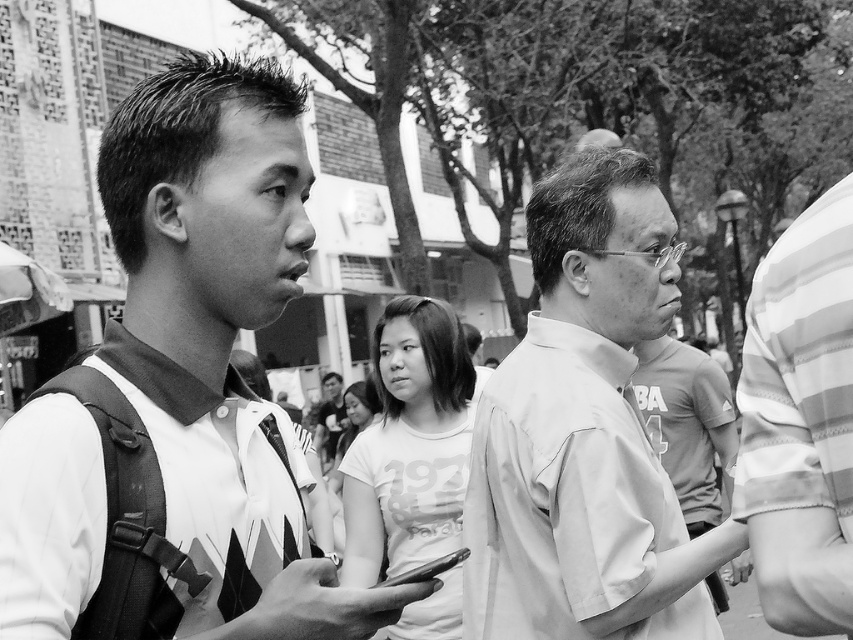
Question: Does printed fabric shirt at left have a smaller size compared to white matte t-shirt at center?

Choices:
 (A) yes
 (B) no

Answer: (A)

Question: Among these points, which one is farthest from the camera?

Choices:
 (A) (457, 372)
 (B) (15, 602)
 (C) (631, 150)

Answer: (C)

Question: Does printed fabric shirt at left have a lesser width compared to light gray shirt at center?

Choices:
 (A) no
 (B) yes

Answer: (B)

Question: Which object is positioned farthest from the light gray shirt at center?

Choices:
 (A) printed fabric shirt at left
 (B) white matte t-shirt at center

Answer: (A)

Question: Which object appears farthest from the camera in this image?

Choices:
 (A) white matte t-shirt at center
 (B) printed fabric shirt at left
 (C) light gray shirt at center

Answer: (A)

Question: Does printed fabric shirt at left have a greater width compared to light gray shirt at center?

Choices:
 (A) yes
 (B) no

Answer: (B)